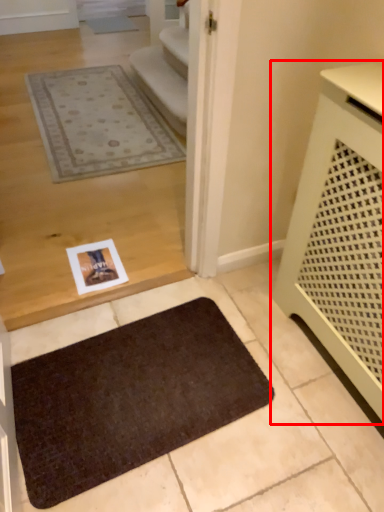
Question: From the image, what is the correct spatial relationship of furniture (annotated by the red box) in relation to mat?

Choices:
 (A) left
 (B) right

Answer: (B)